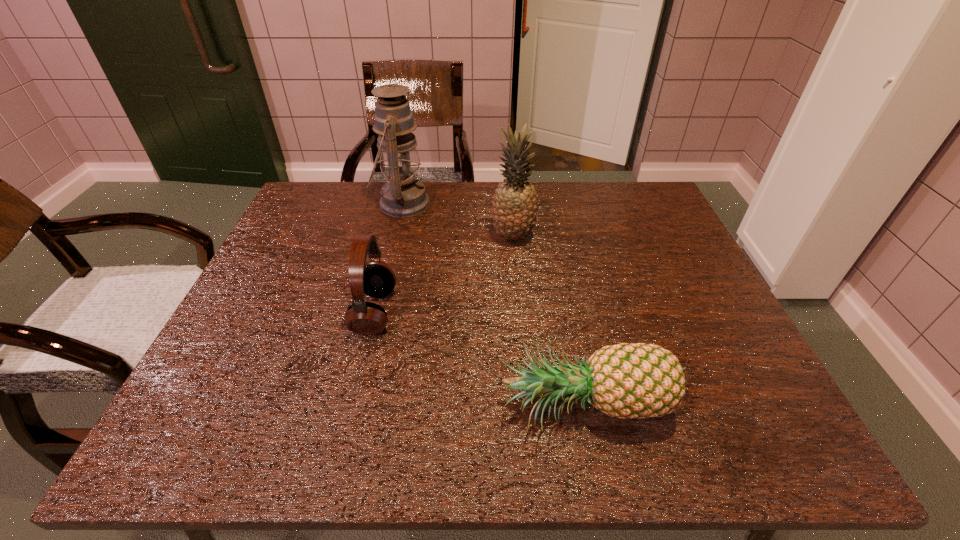
I want to click on object that is the third closest one to the nearest object, so click(403, 195).

You are a GUI agent. You are given a task and a screenshot of the screen. Output one action in this format:
    pyautogui.click(x=<x>, y=<y>)
    Task: Click on the second closest object relative to the farther pineapple
    This screenshot has height=540, width=960.
    Given the screenshot: What is the action you would take?
    pyautogui.click(x=376, y=279)

Locate an element on the screen. vacant position in the image that satisfies the following two spatial constraints: 1. on the front side of the nearest object; 2. on the right side of the oil lamp is located at coordinates (353, 408).

The width and height of the screenshot is (960, 540). Identify the location of vacant space that satisfies the following two spatial constraints: 1. on the ear pads of the headset; 2. on the right side of the nearest object. (351, 408).